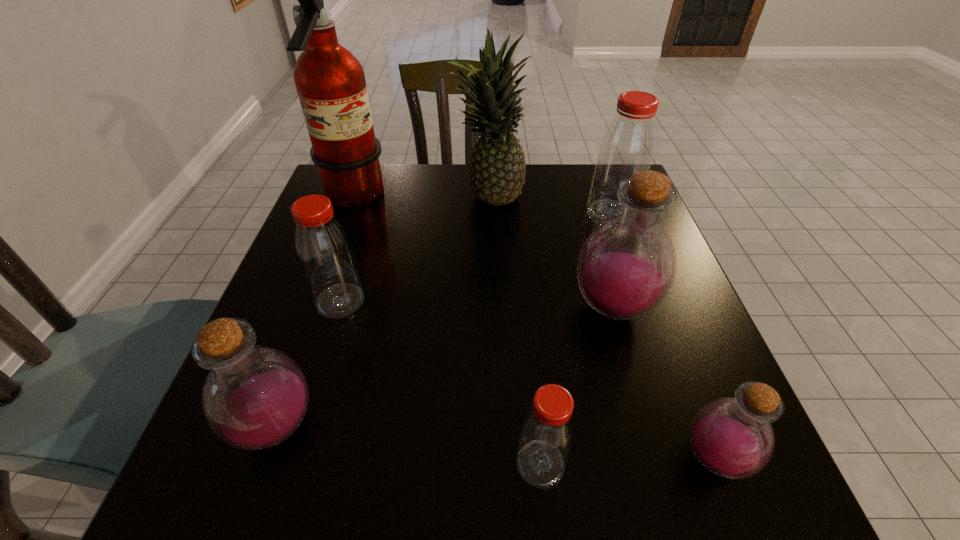
This screenshot has height=540, width=960. I want to click on purple bottle that is the nearest to the smallest purple bottle, so click(626, 267).

Locate an element on the screen. Image resolution: width=960 pixels, height=540 pixels. free location that satisfies the following two spatial constraints: 1. on the nozzle and handle of the tallest object; 2. on the right side of the seventh shortest object is located at coordinates (351, 201).

In order to click on vacant area that satisfies the following two spatial constraints: 1. on the front side of the pineapple; 2. on the left side of the second red bottle from right to left in this screenshot , I will do `click(495, 464)`.

The width and height of the screenshot is (960, 540). Find the location of `vacant space that satisfies the following two spatial constraints: 1. on the nozzle and handle of the tallest object; 2. on the right side of the rightmost red bottle`. vacant space that satisfies the following two spatial constraints: 1. on the nozzle and handle of the tallest object; 2. on the right side of the rightmost red bottle is located at coordinates (347, 214).

Identify the location of free space that satisfies the following two spatial constraints: 1. on the nozzle and handle of the fire extinguisher; 2. on the left side of the second biggest red bottle. The image size is (960, 540). (315, 301).

The image size is (960, 540). What are the coordinates of `vacant point that satisfies the following two spatial constraints: 1. on the nozzle and handle of the farthest bottle; 2. on the right side of the fire extinguisher` in the screenshot? It's located at (347, 214).

In order to click on vacant space that satisfies the following two spatial constraints: 1. on the nozzle and handle of the tallest object; 2. on the right side of the rightmost red bottle in this screenshot , I will do `click(347, 214)`.

Identify the location of free location that satisfies the following two spatial constraints: 1. on the nozzle and handle of the second biggest purple bottle; 2. on the left side of the tallest object. Image resolution: width=960 pixels, height=540 pixels. (269, 427).